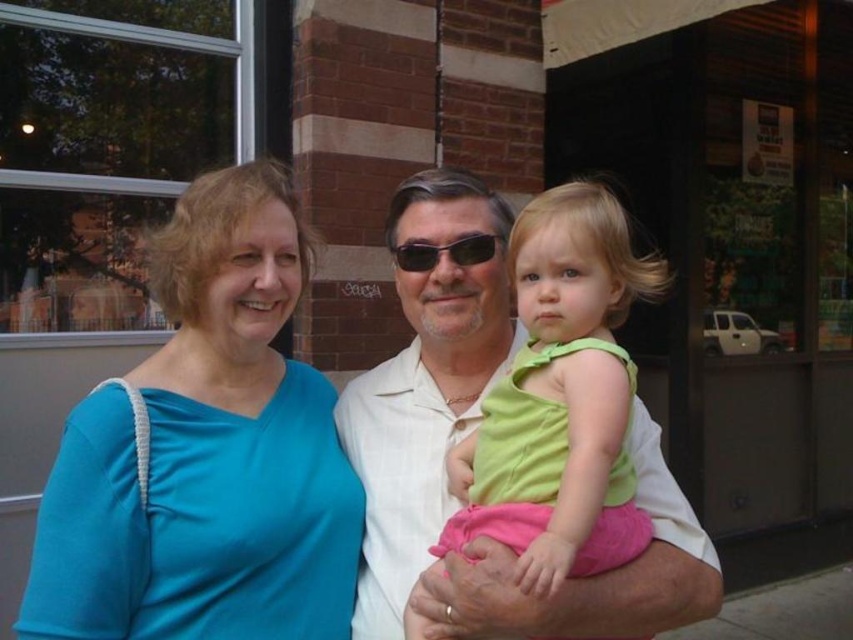
Describe the element at coordinates (465, 435) in the screenshot. I see `white smooth shirt at center` at that location.

Between point (448, 317) and point (410, 241), which one is positioned behind?

The point (410, 241) is behind.

The width and height of the screenshot is (853, 640). I want to click on white smooth shirt at center, so click(465, 435).

Does blue fabric shirt at upper left appear on the left side of black plastic sunglasses at center?

Indeed, blue fabric shirt at upper left is positioned on the left side of black plastic sunglasses at center.

This screenshot has height=640, width=853. In order to click on blue fabric shirt at upper left in this screenshot , I will do [x=206, y=451].

You are a GUI agent. You are given a task and a screenshot of the screen. Output one action in this format:
    pyautogui.click(x=<x>, y=<y>)
    Task: Click on the blue fabric shirt at upper left
    Image resolution: width=853 pixels, height=640 pixels.
    Given the screenshot: What is the action you would take?
    pyautogui.click(x=206, y=451)

This screenshot has height=640, width=853. I want to click on blue fabric shirt at upper left, so click(x=206, y=451).

Which is more to the right, blue fabric shirt at upper left or white smooth shirt at center?

white smooth shirt at center is more to the right.

Between point (177, 259) and point (399, 452), which one is positioned in front?

Point (177, 259) is more forward.

The height and width of the screenshot is (640, 853). In order to click on blue fabric shirt at upper left in this screenshot , I will do `click(206, 451)`.